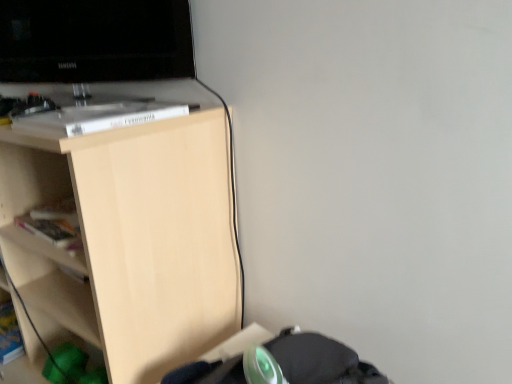
Question: Is light wood shelf at upper left aimed at black glossy television at upper left?

Choices:
 (A) yes
 (B) no

Answer: (B)

Question: Is light wood shelf at upper left closer to the viewer compared to black glossy television at upper left?

Choices:
 (A) yes
 (B) no

Answer: (A)

Question: Is light wood shelf at upper left bigger than black glossy television at upper left?

Choices:
 (A) yes
 (B) no

Answer: (A)

Question: Considering the relative positions of light wood shelf at upper left and black glossy television at upper left in the image provided, is light wood shelf at upper left to the right of black glossy television at upper left from the viewer's perspective?

Choices:
 (A) no
 (B) yes

Answer: (A)

Question: Does light wood shelf at upper left appear on the left side of black glossy television at upper left?

Choices:
 (A) yes
 (B) no

Answer: (A)

Question: Can you confirm if light wood shelf at upper left is wider than black glossy television at upper left?

Choices:
 (A) no
 (B) yes

Answer: (B)

Question: Is black glossy television at upper left oriented towards light wood shelf at upper left?

Choices:
 (A) yes
 (B) no

Answer: (B)

Question: Is black glossy television at upper left positioned far away from light wood shelf at upper left?

Choices:
 (A) yes
 (B) no

Answer: (B)

Question: Is black glossy television at upper left in front of light wood shelf at upper left?

Choices:
 (A) no
 (B) yes

Answer: (A)

Question: Can you confirm if black glossy television at upper left is shorter than light wood shelf at upper left?

Choices:
 (A) no
 (B) yes

Answer: (B)

Question: Considering the relative sizes of black glossy television at upper left and light wood shelf at upper left in the image provided, is black glossy television at upper left taller than light wood shelf at upper left?

Choices:
 (A) no
 (B) yes

Answer: (A)

Question: From a real-world perspective, is black glossy television at upper left physically above light wood shelf at upper left?

Choices:
 (A) yes
 (B) no

Answer: (A)

Question: From the image's perspective, is black glossy television at upper left positioned above or below light wood shelf at upper left?

Choices:
 (A) above
 (B) below

Answer: (A)